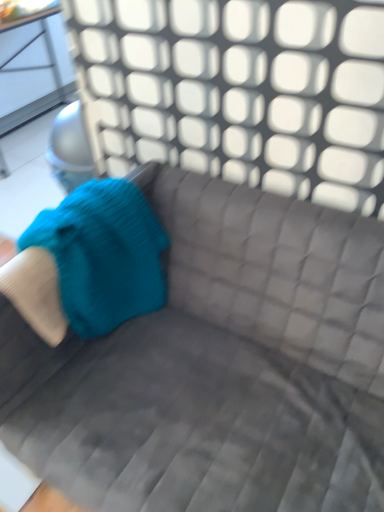
Question: Looking at their shapes, would you say velvet gray couch at center is wider or thinner than teal knitted bean bag chair at left?

Choices:
 (A) thin
 (B) wide

Answer: (B)

Question: In the image, is velvet gray couch at center positioned in front of or behind teal knitted bean bag chair at left?

Choices:
 (A) front
 (B) behind

Answer: (A)

Question: From the image's perspective, is velvet gray couch at center located above or below teal knitted bean bag chair at left?

Choices:
 (A) above
 (B) below

Answer: (B)

Question: In terms of width, does teal knitted bean bag chair at left look wider or thinner when compared to velvet gray couch at center?

Choices:
 (A) thin
 (B) wide

Answer: (A)

Question: Is teal knitted bean bag chair at left situated inside velvet gray couch at center or outside?

Choices:
 (A) inside
 (B) outside

Answer: (A)

Question: From their relative heights in the image, would you say teal knitted bean bag chair at left is taller or shorter than velvet gray couch at center?

Choices:
 (A) tall
 (B) short

Answer: (B)

Question: From a real-world perspective, relative to velvet gray couch at center, is teal knitted bean bag chair at left vertically above or below?

Choices:
 (A) below
 (B) above

Answer: (B)